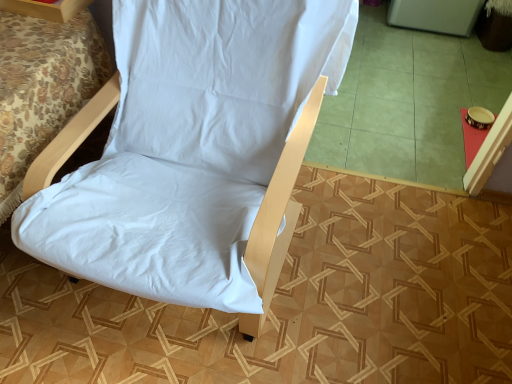
Question: Is the depth of white fabric chair at upper left greater than that of white fabric bed at lower left?

Choices:
 (A) yes
 (B) no

Answer: (A)

Question: Is white fabric bed at lower left located within white fabric chair at upper left?

Choices:
 (A) yes
 (B) no

Answer: (B)

Question: Is white fabric chair at upper left not close to white fabric bed at lower left?

Choices:
 (A) yes
 (B) no

Answer: (B)

Question: Is white fabric chair at upper left positioned with its back to white fabric bed at lower left?

Choices:
 (A) no
 (B) yes

Answer: (A)

Question: Can you confirm if white fabric chair at upper left is positioned to the right of white fabric bed at lower left?

Choices:
 (A) no
 (B) yes

Answer: (B)

Question: From a real-world perspective, is white fabric chair at center positioned above or below white fabric chair at upper left?

Choices:
 (A) below
 (B) above

Answer: (A)

Question: From the image's perspective, is white fabric chair at center located above or below white fabric chair at upper left?

Choices:
 (A) below
 (B) above

Answer: (A)

Question: Considering the positions of point (303, 16) and point (47, 11), is point (303, 16) closer or farther from the camera than point (47, 11)?

Choices:
 (A) closer
 (B) farther

Answer: (A)

Question: Is white fabric chair at center situated inside white fabric chair at upper left or outside?

Choices:
 (A) outside
 (B) inside

Answer: (A)

Question: Looking at their shapes, would you say white fabric bed at lower left is wider or thinner than white fabric chair at upper left?

Choices:
 (A) wide
 (B) thin

Answer: (A)

Question: Does point (17, 38) appear closer or farther from the camera than point (61, 18)?

Choices:
 (A) farther
 (B) closer

Answer: (B)

Question: From the image's perspective, is white fabric bed at lower left positioned above or below white fabric chair at upper left?

Choices:
 (A) below
 (B) above

Answer: (A)

Question: Would you say white fabric bed at lower left is inside or outside white fabric chair at upper left?

Choices:
 (A) outside
 (B) inside

Answer: (A)

Question: In terms of width, does white fabric bed at lower left look wider or thinner when compared to green tile at center?

Choices:
 (A) thin
 (B) wide

Answer: (A)

Question: Is white fabric bed at lower left to the left or to the right of green tile at center in the image?

Choices:
 (A) right
 (B) left

Answer: (B)